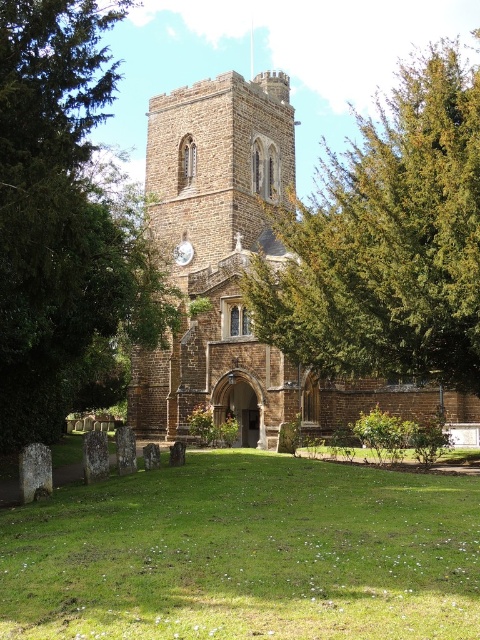
Is green grass at center shorter than green leafy tree at upper center?

Answer: Indeed, green grass at center has a lesser height compared to green leafy tree at upper center.

This screenshot has height=640, width=480. Describe the element at coordinates (245, 554) in the screenshot. I see `green grass at center` at that location.

The image size is (480, 640). In order to click on green grass at center in this screenshot , I will do `click(245, 554)`.

Between green leafy tree at center and brown stone church at center, which one is positioned higher?

brown stone church at center is higher up.

Can you confirm if green leafy tree at center is taller than brown stone church at center?

Incorrect, green leafy tree at center's height is not larger of brown stone church at center's.

The image size is (480, 640). In order to click on green leafy tree at center in this screenshot , I will do pyautogui.click(x=63, y=225).

Does point (100, 541) come closer to viewer compared to point (214, 196)?

Yes, point (100, 541) is closer to viewer.

Identify the location of green grass at center. (245, 554).

The width and height of the screenshot is (480, 640). In order to click on green grass at center in this screenshot , I will do `click(245, 554)`.